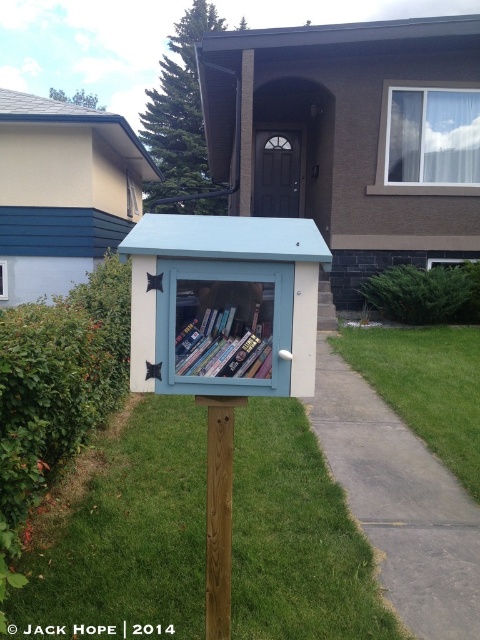
Question: Can you confirm if brown wooden post at center is bigger than hardcover books at center?

Choices:
 (A) no
 (B) yes

Answer: (B)

Question: Which point is farther to the camera?

Choices:
 (A) (220, 593)
 (B) (187, 349)

Answer: (A)

Question: Among these points, which one is nearest to the camera?

Choices:
 (A) (229, 556)
 (B) (220, 353)

Answer: (B)

Question: Is brown wooden post at center positioned in front of hardcover books at center?

Choices:
 (A) yes
 (B) no

Answer: (B)

Question: Does brown wooden post at center have a greater width compared to hardcover books at center?

Choices:
 (A) no
 (B) yes

Answer: (A)